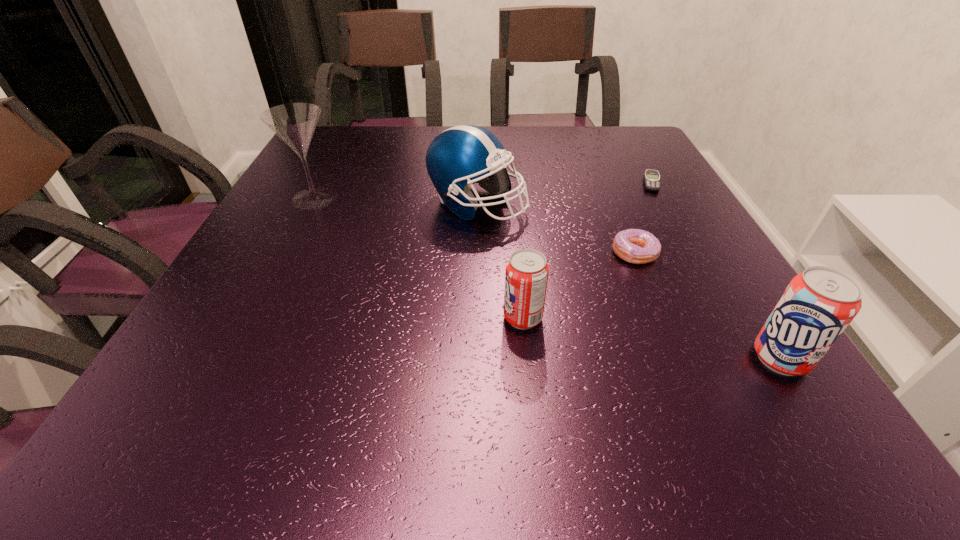
In order to click on blank space located 0.210m on the back of the taller soda can in this screenshot , I will do `click(717, 257)`.

At what (x,y) coordinates should I click in order to perform the action: click on vacant space located on the back of the shortest object. Please return your answer as a coordinate pair (x, y). The width and height of the screenshot is (960, 540). Looking at the image, I should click on (636, 156).

Where is `free space located at the front of the football helmet with the faceguard`? free space located at the front of the football helmet with the faceguard is located at coordinates (673, 204).

Find the location of a particular element. This screenshot has width=960, height=540. vacant space located on the back of the flute glass is located at coordinates (330, 167).

The width and height of the screenshot is (960, 540). Find the location of `vacant region located 0.140m on the back of the doughnut`. vacant region located 0.140m on the back of the doughnut is located at coordinates (613, 203).

Where is `object at the left edge`? object at the left edge is located at coordinates (294, 123).

Where is `soda can located in the right edge section of the desktop`? This screenshot has height=540, width=960. soda can located in the right edge section of the desktop is located at coordinates (817, 306).

You are a GUI agent. You are given a task and a screenshot of the screen. Output one action in this format:
    pyautogui.click(x=<x>, y=<y>)
    Task: Click on the beeper at the right edge
    This screenshot has height=540, width=960.
    Given the screenshot: What is the action you would take?
    pyautogui.click(x=652, y=180)

Identify the location of doughnut that is at the right edge. This screenshot has height=540, width=960. (636, 246).

Where is `object located in the near right corner section of the desktop`? The image size is (960, 540). object located in the near right corner section of the desktop is located at coordinates (817, 306).